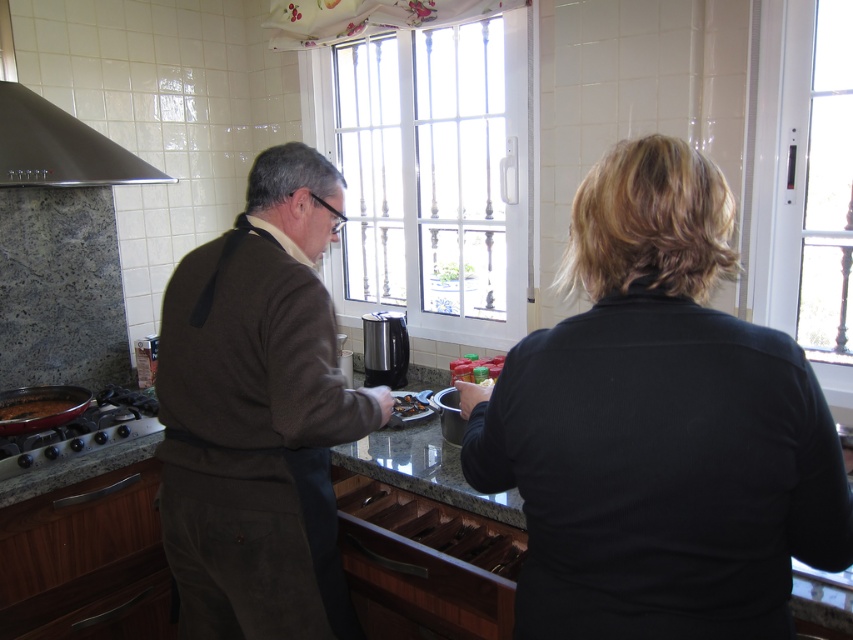
Please look at the point marked as point (659, 426) in the image. What object or part of an object is located at this point?

The point (659, 426) corresponds to the black matte shirt at center.

You are a chef standing in the kitchen and want to grab the brown matte pan at left to stir the sauce. However, there is a brown corduroy sweater at center in the way. Can you reach the pan without moving the sweater?

The brown corduroy sweater at center is closer to the viewer than the brown matte pan at left, so you would need to move the sweater first to access the pan.